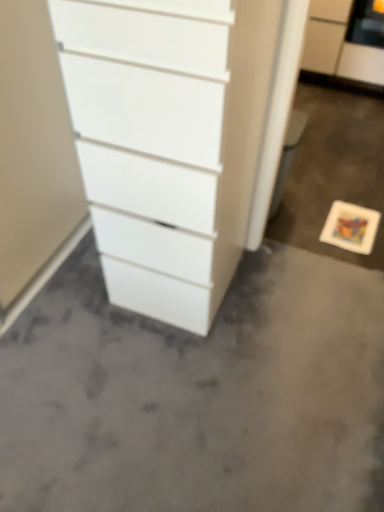
Question: Considering the relative sizes of white glossy chest of drawers at center and gray matte concrete at center in the image provided, is white glossy chest of drawers at center bigger than gray matte concrete at center?

Choices:
 (A) no
 (B) yes

Answer: (B)

Question: Is white glossy chest of drawers at center to the right of gray matte concrete at center from the viewer's perspective?

Choices:
 (A) no
 (B) yes

Answer: (A)

Question: From the image's perspective, is white glossy chest of drawers at center under gray matte concrete at center?

Choices:
 (A) no
 (B) yes

Answer: (A)

Question: Is white glossy chest of drawers at center with gray matte concrete at center?

Choices:
 (A) no
 (B) yes

Answer: (A)

Question: From a real-world perspective, is white glossy chest of drawers at center over gray matte concrete at center?

Choices:
 (A) no
 (B) yes

Answer: (B)

Question: From the image's perspective, relative to white matte filing cabinet at upper right, is gray matte concrete at center above or below?

Choices:
 (A) below
 (B) above

Answer: (A)

Question: Considering the positions of gray matte concrete at center and white matte filing cabinet at upper right in the image, is gray matte concrete at center taller or shorter than white matte filing cabinet at upper right?

Choices:
 (A) tall
 (B) short

Answer: (B)

Question: Is gray matte concrete at center in front of or behind white matte filing cabinet at upper right in the image?

Choices:
 (A) front
 (B) behind

Answer: (A)

Question: Looking at the image, does gray matte concrete at center seem bigger or smaller compared to white matte filing cabinet at upper right?

Choices:
 (A) small
 (B) big

Answer: (A)

Question: From the image's perspective, is white matte filing cabinet at upper right located above or below gray matte concrete at center?

Choices:
 (A) above
 (B) below

Answer: (A)

Question: Is white matte filing cabinet at upper right situated inside gray matte concrete at center or outside?

Choices:
 (A) inside
 (B) outside

Answer: (B)

Question: From their relative heights in the image, would you say white matte filing cabinet at upper right is taller or shorter than gray matte concrete at center?

Choices:
 (A) short
 (B) tall

Answer: (B)

Question: Looking at the image, does white matte filing cabinet at upper right seem bigger or smaller compared to gray matte concrete at center?

Choices:
 (A) big
 (B) small

Answer: (A)

Question: Is gray matte concrete at center wider or thinner than white glossy chest of drawers at center?

Choices:
 (A) wide
 (B) thin

Answer: (A)

Question: Looking at the image, does gray matte concrete at center seem bigger or smaller compared to white glossy chest of drawers at center?

Choices:
 (A) small
 (B) big

Answer: (A)